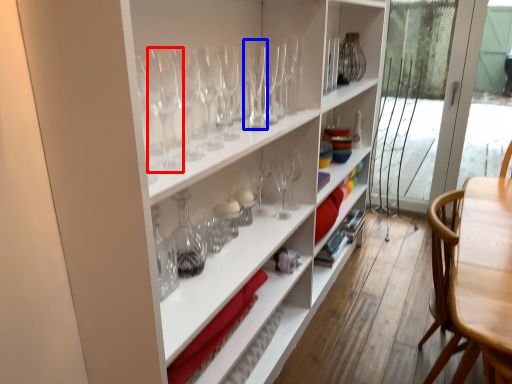
Question: Which object appears closest to the camera in this image, wine glass (highlighted by a red box) or wine glass (highlighted by a blue box)?

Choices:
 (A) wine glass
 (B) wine glass

Answer: (A)